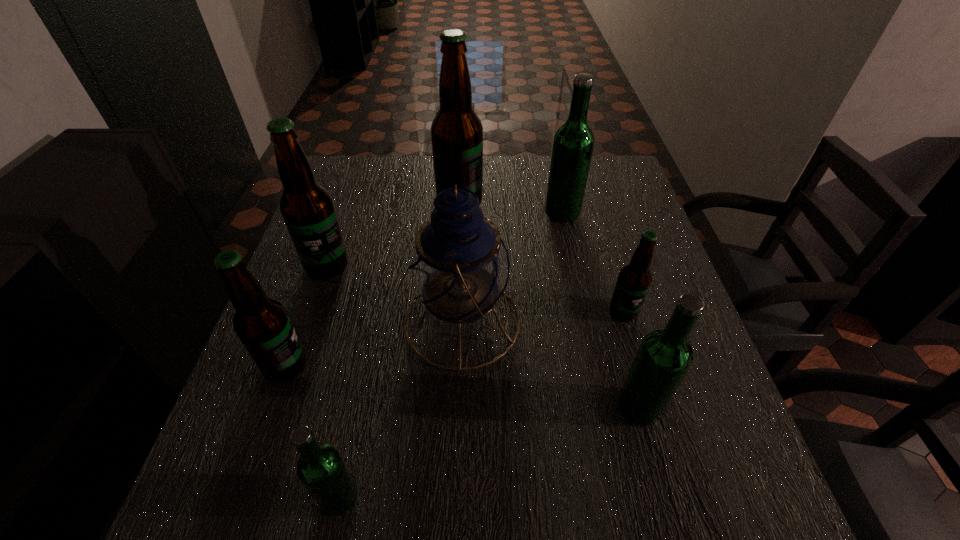
Locate an element on the screen. the third closest beer bottle to the fourth nearest beer bottle is located at coordinates (456, 132).

Identify which beer bottle is the third closest to the nearest beer bottle. Please provide its 2D coordinates. Your answer should be formatted as a tuple, i.e. [(x, y)], where the tuple contains the x and y coordinates of a point satisfying the conditions above.

[(664, 357)]

Locate which brown beer bottle is the second closest to the third farthest brown beer bottle. Please provide its 2D coordinates. Your answer should be formatted as a tuple, i.e. [(x, y)], where the tuple contains the x and y coordinates of a point satisfying the conditions above.

[(307, 208)]

Choose which brown beer bottle is the third nearest neighbor to the biggest brown beer bottle. Please provide its 2D coordinates. Your answer should be formatted as a tuple, i.e. [(x, y)], where the tuple contains the x and y coordinates of a point satisfying the conditions above.

[(262, 324)]

At what (x,y) coordinates should I click in order to perform the action: click on the closest green beer bottle relative to the fourth nearest beer bottle. Please return your answer as a coordinate pair (x, y). Looking at the image, I should click on click(x=664, y=357).

The image size is (960, 540). What are the coordinates of `green beer bottle that is the third closest to the tallest beer bottle` in the screenshot? It's located at (321, 469).

You are a GUI agent. You are given a task and a screenshot of the screen. Output one action in this format:
    pyautogui.click(x=<x>, y=<y>)
    Task: Click on the vacant space that satisfies the following two spatial constraints: 1. on the label of the biggest brown beer bottle; 2. on the left side of the farthest green beer bottle
    This screenshot has height=540, width=960.
    Given the screenshot: What is the action you would take?
    pyautogui.click(x=459, y=212)

Where is `vacant area in the image that satisfies the following two spatial constraints: 1. on the label of the rightmost brown beer bottle; 2. on the front-facing side of the blue lantern`? This screenshot has width=960, height=540. vacant area in the image that satisfies the following two spatial constraints: 1. on the label of the rightmost brown beer bottle; 2. on the front-facing side of the blue lantern is located at coordinates (626, 321).

The height and width of the screenshot is (540, 960). I want to click on vacant region that satisfies the following two spatial constraints: 1. on the label of the biggest brown beer bottle; 2. on the front side of the nearest object, so click(x=444, y=497).

Find the location of a particular element. blank area in the image that satisfies the following two spatial constraints: 1. on the label of the smallest brown beer bottle; 2. on the front-facing side of the lantern is located at coordinates (626, 321).